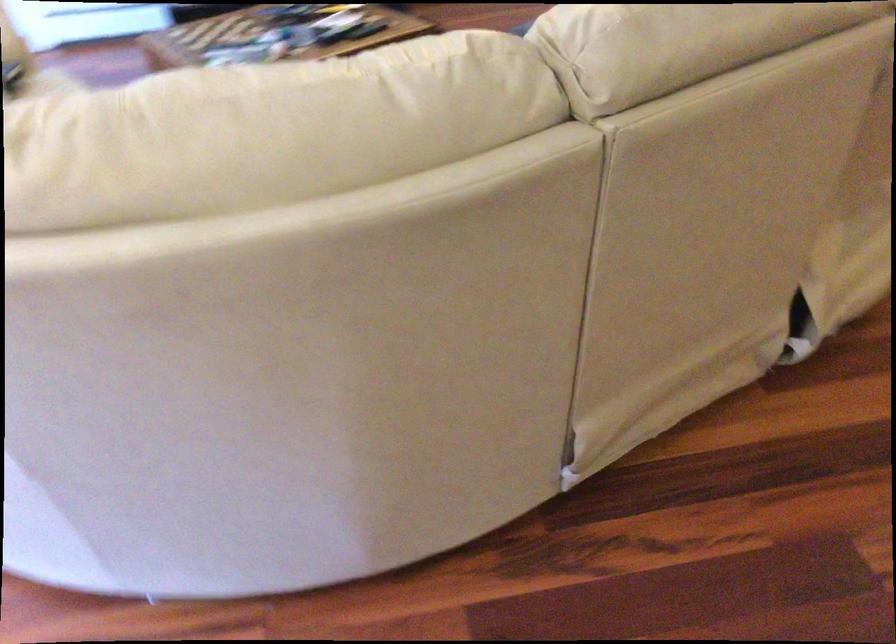
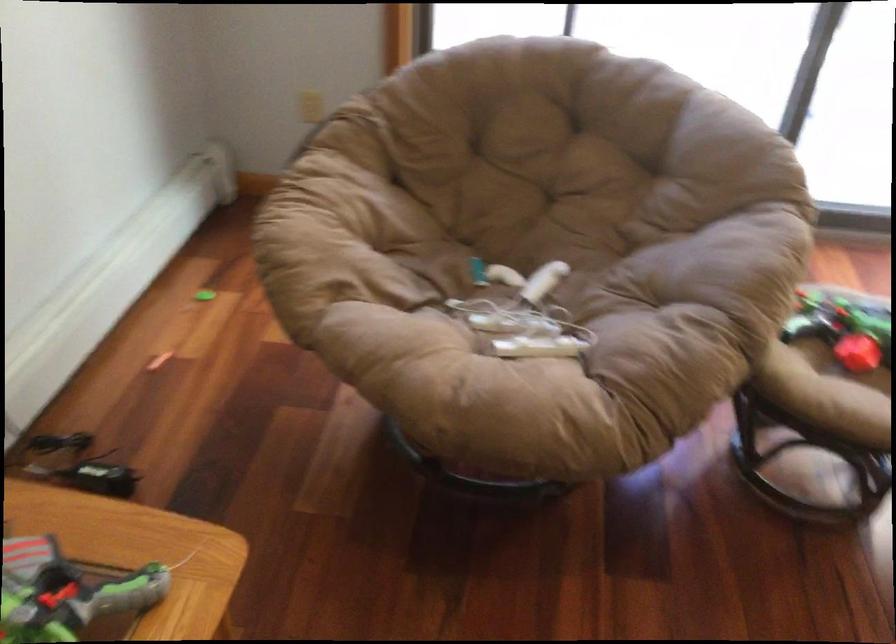
The images are taken continuously from a first-person perspective. In which direction is your viewpoint rotating?

The camera's rotation is toward left-down.